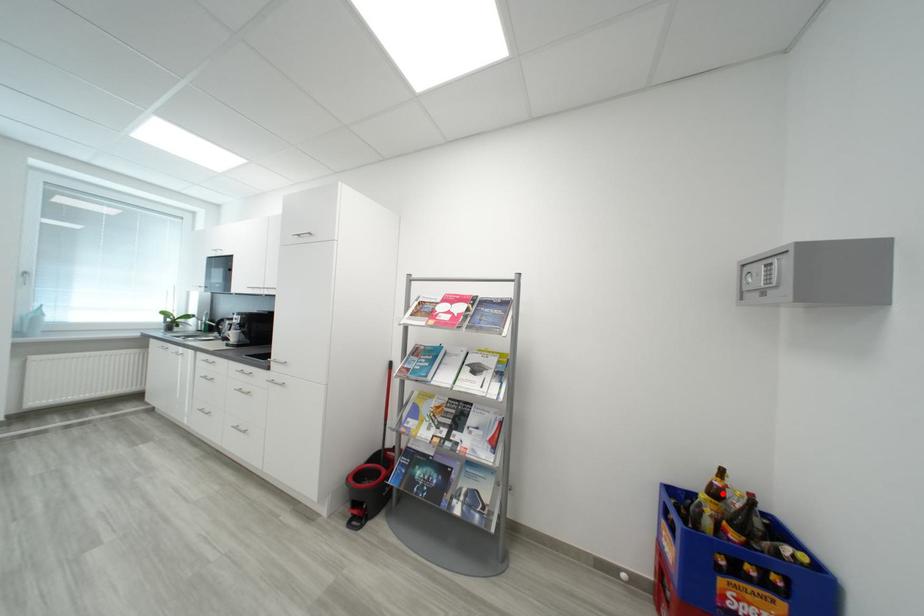
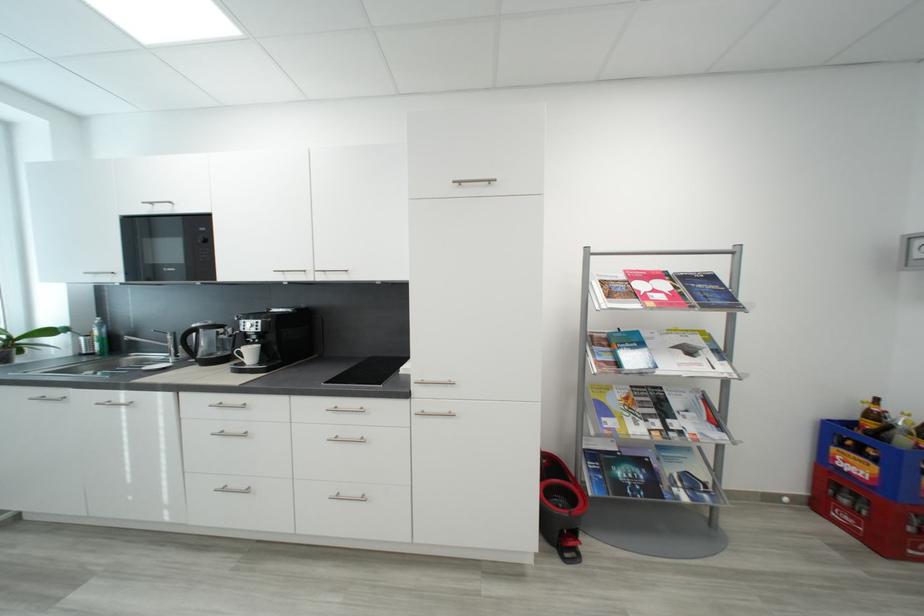
Question: I am providing you with two images of the same scene from different viewpoints. A red point is shown in image1. For the corresponding object point in image2, is it positioned nearer or farther from the camera?

Choices:
 (A) Nearer
 (B) Farther

Answer: (A)